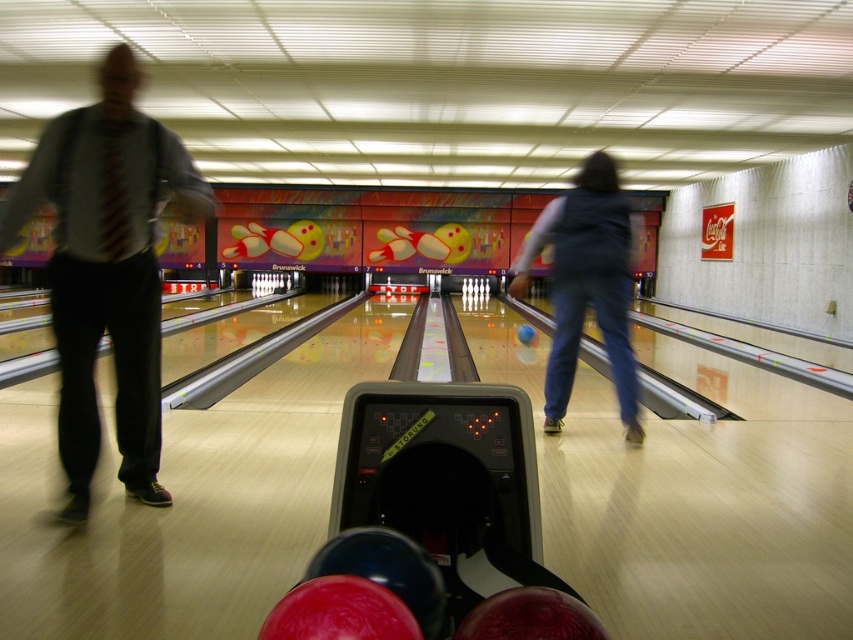
Question: In this image, where is matte gray shirt at left located relative to blue denim jeans at center?

Choices:
 (A) right
 (B) left

Answer: (B)

Question: Is matte gray shirt at left thinner than blue denim jeans at center?

Choices:
 (A) no
 (B) yes

Answer: (A)

Question: Which of the following is the closest to the observer?

Choices:
 (A) (540, 228)
 (B) (83, 259)

Answer: (B)

Question: Which object appears closest to the camera in this image?

Choices:
 (A) matte gray shirt at left
 (B) blue denim jeans at center

Answer: (A)

Question: In this image, where is matte gray shirt at left located relative to blue denim jeans at center?

Choices:
 (A) left
 (B) right

Answer: (A)